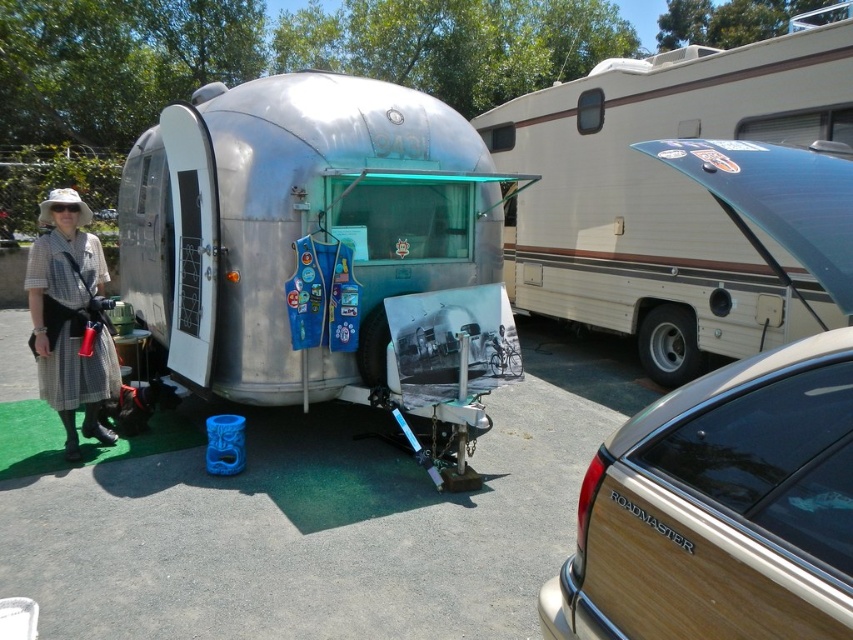
Can you confirm if shiny aluminum trailer at center is wider than checkered fabric dress at lower left?

Indeed, shiny aluminum trailer at center has a greater width compared to checkered fabric dress at lower left.

Who is higher up, shiny aluminum trailer at center or checkered fabric dress at lower left?

shiny aluminum trailer at center is higher up.

Does point (178, 280) lie in front of point (76, 349)?

No, (178, 280) is further to viewer.

In order to click on shiny aluminum trailer at center in this screenshot , I will do `click(320, 246)`.

Can you confirm if teal woodgrain roadmaster at right is taller than beige vinyl recreational vehicle at upper right?

Correct, teal woodgrain roadmaster at right is much taller as beige vinyl recreational vehicle at upper right.

Who is positioned more to the right, teal woodgrain roadmaster at right or beige vinyl recreational vehicle at upper right?

Positioned to the right is beige vinyl recreational vehicle at upper right.

Is point (747, 529) behind point (724, 298)?

No, (747, 529) is in front of (724, 298).

Where is `teal woodgrain roadmaster at right`? teal woodgrain roadmaster at right is located at coordinates (720, 508).

Describe the element at coordinates (668, 196) in the screenshot. I see `beige vinyl recreational vehicle at upper right` at that location.

Which is above, beige vinyl recreational vehicle at upper right or checkered fabric dress at lower left?

beige vinyl recreational vehicle at upper right

Is point (706, 296) closer to viewer compared to point (44, 298)?

No, (706, 296) is further to viewer.

Identify the location of beige vinyl recreational vehicle at upper right. (668, 196).